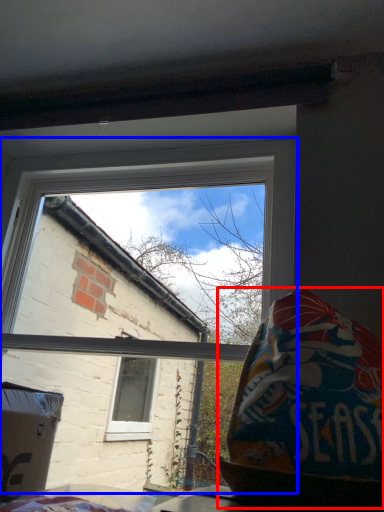
Question: Which object is closer to the camera taking this photo, bean bag chair (highlighted by a red box) or window (highlighted by a blue box)?

Choices:
 (A) bean bag chair
 (B) window

Answer: (A)